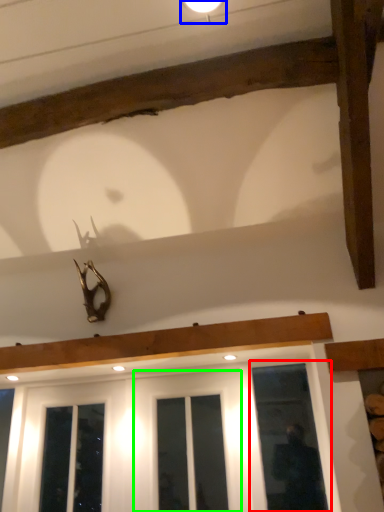
Question: Considering the real-world distances, which object is farthest from window (highlighted by a red box)? light fixture (highlighted by a blue box) or screen door (highlighted by a green box)?

Choices:
 (A) light fixture
 (B) screen door

Answer: (A)